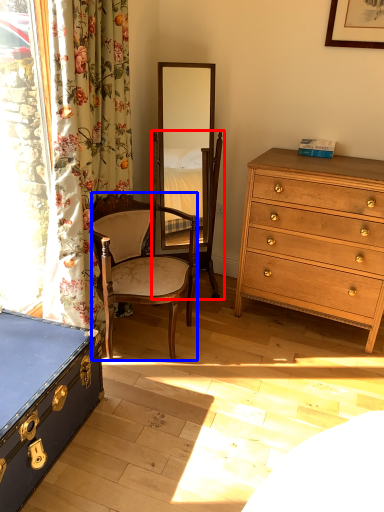
Question: Which object appears closest to the camera in this image, swivel chair (highlighted by a red box) or chair (highlighted by a blue box)?

Choices:
 (A) swivel chair
 (B) chair

Answer: (B)